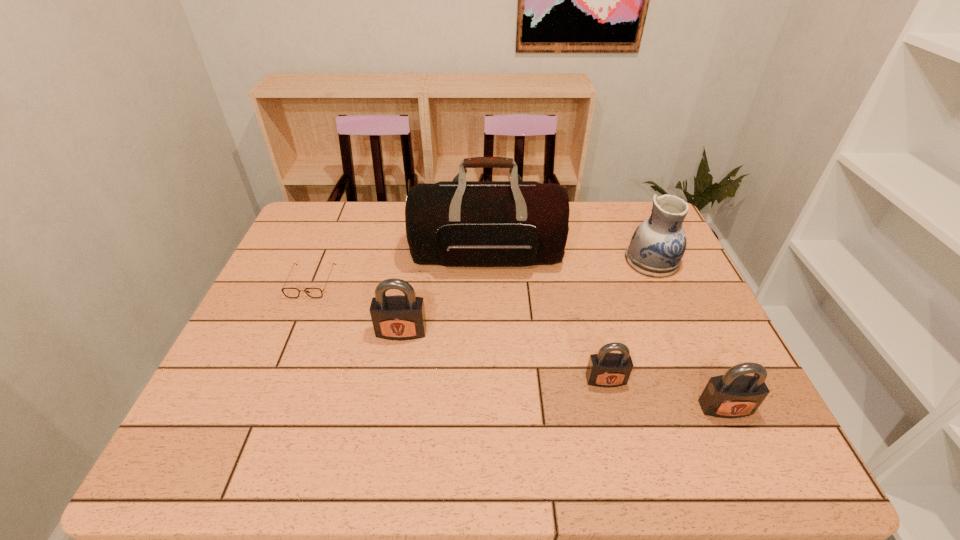
The width and height of the screenshot is (960, 540). In order to click on empty location between the shortest padlock and the rightmost padlock in this screenshot , I will do `click(665, 394)`.

Locate an element on the screen. The image size is (960, 540). free spot between the second tallest object and the shortest object is located at coordinates (482, 272).

Find the location of a particular element. Image resolution: width=960 pixels, height=540 pixels. free space between the sunglasses and the farthest padlock is located at coordinates (356, 307).

What are the coordinates of `vacant space in between the fourth farthest object and the second padlock from left to right` in the screenshot? It's located at (504, 355).

Locate an element on the screen. Image resolution: width=960 pixels, height=540 pixels. vacant region between the leftmost object and the second padlock from left to right is located at coordinates (459, 331).

Image resolution: width=960 pixels, height=540 pixels. I want to click on free space between the fifth shortest object and the tallest object, so click(x=569, y=258).

Where is `vacant area that lies between the sunglasses and the second nearest padlock`? The width and height of the screenshot is (960, 540). vacant area that lies between the sunglasses and the second nearest padlock is located at coordinates (459, 331).

The height and width of the screenshot is (540, 960). Identify the location of free space that is in between the sunglasses and the fifth tallest object. (459, 331).

The width and height of the screenshot is (960, 540). Identify the location of object that is the second closest one to the leftmost object. (459, 223).

Identify the location of object that stands as the fourth closest to the shortest padlock. (398, 317).